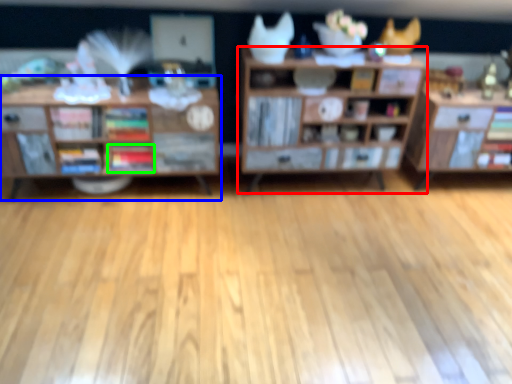
Question: Estimate the real-world distances between objects in this image. Which object is closer to shelf (highlighted by a red box), shelf (highlighted by a blue box) or book (highlighted by a green box)?

Choices:
 (A) shelf
 (B) book

Answer: (A)